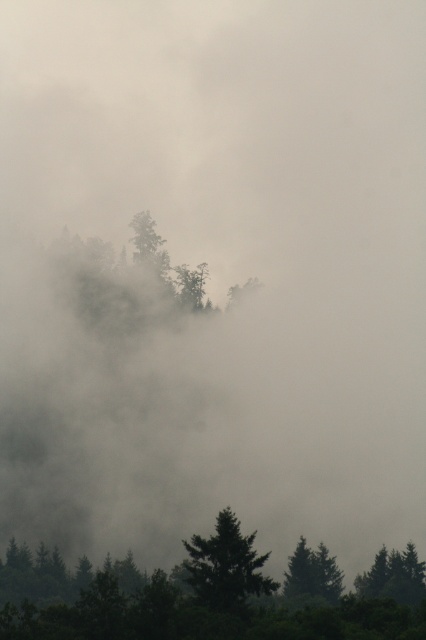
Question: Does green matte trees at lower center appear under green matte tree at lower center?

Choices:
 (A) yes
 (B) no

Answer: (A)

Question: Which point appears farthest from the camera in this image?

Choices:
 (A) (28, 636)
 (B) (256, 556)

Answer: (B)

Question: Can you confirm if green matte trees at lower center is thinner than green matte tree at lower center?

Choices:
 (A) no
 (B) yes

Answer: (A)

Question: Which object is closer to the camera taking this photo?

Choices:
 (A) green matte tree at lower center
 (B) green matte trees at lower center

Answer: (B)

Question: Which point is farther to the camera?

Choices:
 (A) (192, 586)
 (B) (224, 576)

Answer: (B)

Question: Is green matte trees at lower center to the left of green matte tree at lower center from the viewer's perspective?

Choices:
 (A) yes
 (B) no

Answer: (B)